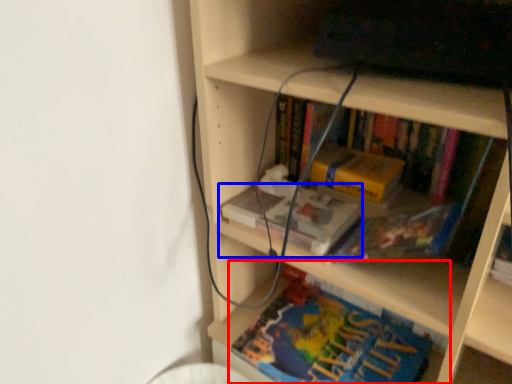
Question: Which object is further to the camera taking this photo, book (highlighted by a red box) or book (highlighted by a blue box)?

Choices:
 (A) book
 (B) book

Answer: (B)